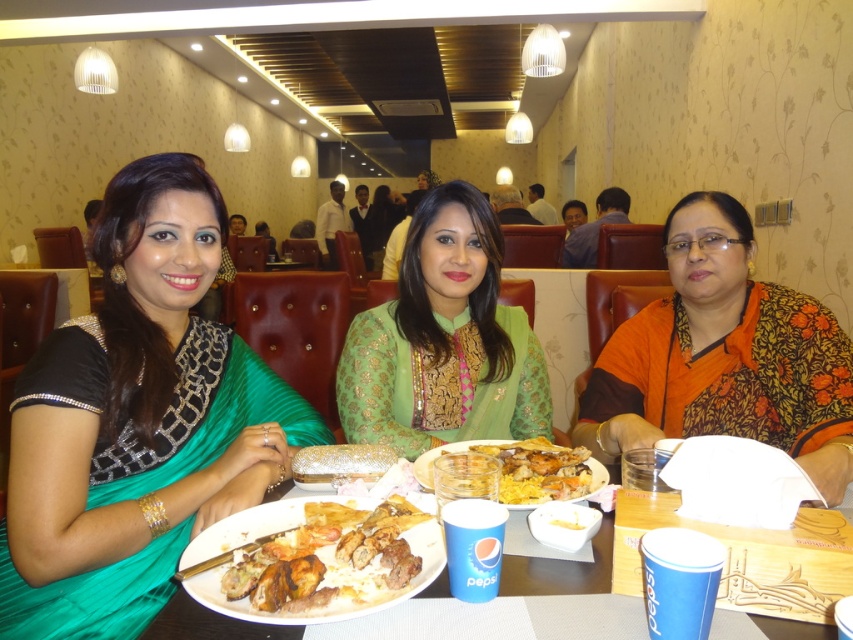
You are a waiter at the restaurant and need to place a new dish on the table. The table has a coordinate system where the bottom left corner is the origin. The new dish must be placed at the exact coordinates of the white paper plate at center. What are the coordinates where you should place the new dish?

The coordinates for the white paper plate at center are 0.891 in the x direction and 0.660 in the y direction.

You are a waiter in a restaurant and need to clear the table. You see a white paper plate at center and a translucent glass bowl at center. Which item should you pick up first to clear the table properly?

You should pick up the white paper plate at center first since it is in front of the translucent glass bowl at center, making it easier to access without disturbing the bowl.